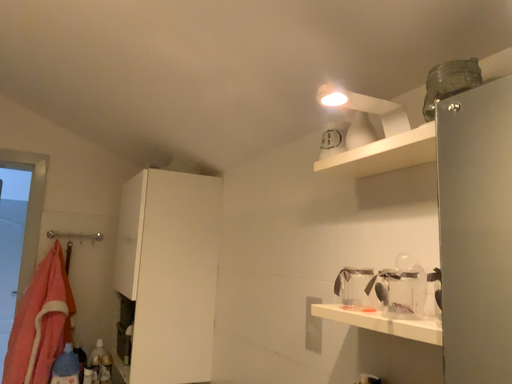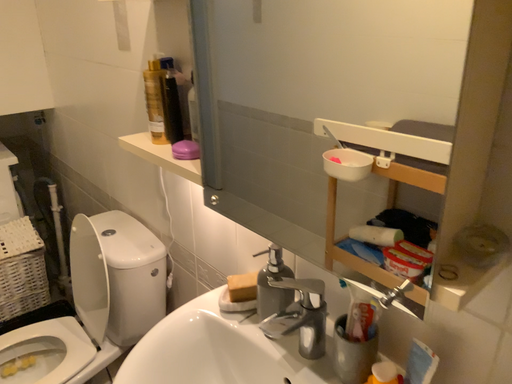
Question: Which way did the camera rotate in the video?

Choices:
 (A) rotated left
 (B) rotated right

Answer: (B)